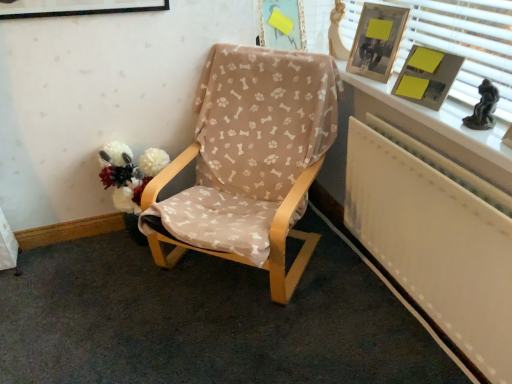
Image resolution: width=512 pixels, height=384 pixels. What do you see at coordinates (426, 76) in the screenshot? I see `yellow paper at upper right` at bounding box center [426, 76].

Where is `yellow paper at upper right`? The image size is (512, 384). yellow paper at upper right is located at coordinates (426, 76).

The image size is (512, 384). Describe the element at coordinates (248, 162) in the screenshot. I see `beige fabric-covered chair at center` at that location.

Measure the distance between white painted wood at upper right and camera.

A distance of 1.34 meters exists between white painted wood at upper right and camera.

Find the location of `matte plastic picture frame at upper center, which ranks as the 1th picture frame in back-to-front order`. matte plastic picture frame at upper center, which ranks as the 1th picture frame in back-to-front order is located at coordinates (282, 24).

Does white painted wood at upper right have a lesser height compared to matte plastic picture frame at upper center, positioned as the 1th picture frame in left-to-right order?

Incorrect, the height of white painted wood at upper right does not fall short of that of matte plastic picture frame at upper center, positioned as the 1th picture frame in left-to-right order.

Is white painted wood at upper right directly adjacent to matte plastic picture frame at upper center, which ranks as the 1th picture frame in back-to-front order?

No, white painted wood at upper right is not making contact with matte plastic picture frame at upper center, which ranks as the 1th picture frame in back-to-front order.

In the scene shown: Does white painted wood at upper right have a smaller size compared to matte plastic picture frame at upper center, acting as the 2th picture frame starting from the right?

Yes.

Where is `picture frame that is the 2nd object located behind the white painted wood at upper right`? This screenshot has width=512, height=384. picture frame that is the 2nd object located behind the white painted wood at upper right is located at coordinates (282, 24).

From the image's perspective, is matte plastic picture frame at upper center, which ranks as the 1th picture frame in back-to-front order, located above or below beige fabric-covered chair at center?

From the image's perspective, matte plastic picture frame at upper center, which ranks as the 1th picture frame in back-to-front order, appears above beige fabric-covered chair at center.

Is matte plastic picture frame at upper center, the 2th picture frame viewed from the front, facing away from beige fabric-covered chair at center?

No, matte plastic picture frame at upper center, the 2th picture frame viewed from the front, is not facing the opposite direction of beige fabric-covered chair at center.

How different are the orientations of matte plastic picture frame at upper center, which ranks as the 1th picture frame in back-to-front order, and beige fabric-covered chair at center in degrees?

There is a 36.7-degree angle between the facing directions of matte plastic picture frame at upper center, which ranks as the 1th picture frame in back-to-front order, and beige fabric-covered chair at center.

Which is farther from the camera, (259, 15) or (228, 123)?

Point (259, 15)

Considering the relative sizes of yellow paper at upper right and white painted wood at upper right in the image provided, is yellow paper at upper right bigger than white painted wood at upper right?

No.

Does yellow paper at upper right contain white painted wood at upper right?

No, white painted wood at upper right is not a part of yellow paper at upper right.

Is there a large distance between yellow paper at upper right and white painted wood at upper right?

yellow paper at upper right is actually quite close to white painted wood at upper right.

Is yellow paper at upper right in front of white painted wood at upper right?

No.

Considering the relative positions of white painted wood at upper right and wooden picture frame at upper right, placed as the second picture frame when sorted from left to right, in the image provided, is white painted wood at upper right behind wooden picture frame at upper right, placed as the second picture frame when sorted from left to right,?

No, white painted wood at upper right is closer to the viewer.

From a real-world perspective, is white painted wood at upper right physically located above or below wooden picture frame at upper right, the second picture frame in the back-to-front sequence?

Clearly, from a real-world perspective, white painted wood at upper right is above wooden picture frame at upper right, the second picture frame in the back-to-front sequence.

Is white painted wood at upper right oriented away from wooden picture frame at upper right, placed as the 1th picture frame when sorted from front to back?

Yes, white painted wood at upper right's orientation is away from wooden picture frame at upper right, placed as the 1th picture frame when sorted from front to back.

Based on the photo, which point is more forward, (456, 90) or (378, 28)?

Point (456, 90)

From a real-world perspective, is wooden picture frame at upper right, placed as the second picture frame when sorted from left to right, physically located above or below beige fabric-covered chair at center?

From a real-world perspective, wooden picture frame at upper right, placed as the second picture frame when sorted from left to right, is physically above beige fabric-covered chair at center.

Is wooden picture frame at upper right, which ranks as the 1th picture frame in right-to-left order, surrounding beige fabric-covered chair at center?

No, beige fabric-covered chair at center is located outside of wooden picture frame at upper right, which ranks as the 1th picture frame in right-to-left order.

What's the angular difference between wooden picture frame at upper right, the second picture frame in the back-to-front sequence, and beige fabric-covered chair at center's facing directions?

38.7 degrees.

From the image's perspective, between wooden picture frame at upper right, the second picture frame in the back-to-front sequence, and beige fabric-covered chair at center, who is located below?

beige fabric-covered chair at center, from the image's perspective.

Who is more distant, yellow paper at upper right or wooden picture frame at upper right, the second picture frame in the back-to-front sequence?

wooden picture frame at upper right, the second picture frame in the back-to-front sequence.

From the image's perspective, which one is positioned lower, yellow paper at upper right or wooden picture frame at upper right, the second picture frame in the back-to-front sequence?

From the image's view, yellow paper at upper right is below.

Can you confirm if yellow paper at upper right is taller than wooden picture frame at upper right, which ranks as the 1th picture frame in right-to-left order?

Incorrect, the height of yellow paper at upper right is not larger of that of wooden picture frame at upper right, which ranks as the 1th picture frame in right-to-left order.

Is yellow paper at upper right not within wooden picture frame at upper right, placed as the 1th picture frame when sorted from front to back?

Absolutely, yellow paper at upper right is external to wooden picture frame at upper right, placed as the 1th picture frame when sorted from front to back.

Could you tell me if beige fabric-covered chair at center is facing wooden picture frame at upper right, placed as the 1th picture frame when sorted from front to back?

No, beige fabric-covered chair at center is not facing towards wooden picture frame at upper right, placed as the 1th picture frame when sorted from front to back.

Based on the photo, how different are the orientations of beige fabric-covered chair at center and wooden picture frame at upper right, the second picture frame in the back-to-front sequence, in degrees?

The facing directions of beige fabric-covered chair at center and wooden picture frame at upper right, the second picture frame in the back-to-front sequence, are 38.7 degrees apart.

Is beige fabric-covered chair at center in front of or behind wooden picture frame at upper right, placed as the 1th picture frame when sorted from front to back, in the image?

In the image, beige fabric-covered chair at center appears in front of wooden picture frame at upper right, placed as the 1th picture frame when sorted from front to back.

From their relative heights in the image, would you say beige fabric-covered chair at center is taller or shorter than wooden picture frame at upper right, placed as the second picture frame when sorted from left to right?

Clearly, beige fabric-covered chair at center is taller compared to wooden picture frame at upper right, placed as the second picture frame when sorted from left to right.

Locate an element on the screen. window frame in front of the matte plastic picture frame at upper center, acting as the 2th picture frame starting from the right is located at coordinates (456, 40).

In order to click on chair that is on the left side of matte plastic picture frame at upper center, which ranks as the 1th picture frame in back-to-front order in this screenshot , I will do [x=248, y=162].

Which object lies nearer to the anchor point white painted wood at upper right, yellow paper at upper right or wooden picture frame at upper right, placed as the second picture frame when sorted from left to right?

Based on the image, yellow paper at upper right appears to be nearer to white painted wood at upper right.

Based on their spatial positions, is wooden picture frame at upper right, placed as the second picture frame when sorted from left to right, or yellow paper at upper right further from matte plastic picture frame at upper center, positioned as the 1th picture frame in left-to-right order?

Based on the image, yellow paper at upper right appears to be further to matte plastic picture frame at upper center, positioned as the 1th picture frame in left-to-right order.

Estimate the real-world distances between objects in this image. Which object is further from beige fabric-covered chair at center, wooden picture frame at upper right, the second picture frame in the back-to-front sequence, or yellow paper at upper right?

Based on the image, yellow paper at upper right appears to be further to beige fabric-covered chair at center.

When comparing their distances from yellow paper at upper right, does white painted wood at upper right or wooden picture frame at upper right, placed as the second picture frame when sorted from left to right, seem closer?

The object closer to yellow paper at upper right is white painted wood at upper right.

Based on their spatial positions, is wooden picture frame at upper right, the second picture frame in the back-to-front sequence, or yellow paper at upper right closer to white painted wood at upper right?

The object closer to white painted wood at upper right is yellow paper at upper right.

From the image, which object appears to be farther from yellow paper at upper right, white painted wood at upper right or matte plastic picture frame at upper center, acting as the 2th picture frame starting from the right?

Among the two, matte plastic picture frame at upper center, acting as the 2th picture frame starting from the right, is located further to yellow paper at upper right.

When comparing their distances from matte plastic picture frame at upper center, acting as the 2th picture frame starting from the right, does wooden picture frame at upper right, placed as the 1th picture frame when sorted from front to back, or beige fabric-covered chair at center seem closer?

A: wooden picture frame at upper right, placed as the 1th picture frame when sorted from front to back.

Looking at the image, which one is located closer to beige fabric-covered chair at center, white painted wood at upper right or yellow paper at upper right?

white painted wood at upper right lies closer to beige fabric-covered chair at center than the other object.

Find the location of a particular element. This screenshot has height=384, width=512. picture frame between yellow paper at upper right and matte plastic picture frame at upper center, the 2th picture frame viewed from the front, from front to back is located at coordinates (377, 40).

The width and height of the screenshot is (512, 384). In order to click on window frame between beige fabric-covered chair at center and yellow paper at upper right in the horizontal direction in this screenshot , I will do pyautogui.click(x=456, y=40).

At what (x,y) coordinates should I click in order to perform the action: click on bulletin board positioned between white painted wood at upper right and matte plastic picture frame at upper center, the 2th picture frame viewed from the front, from near to far. Please return your answer as a coordinate pair (x, y). Looking at the image, I should click on (426, 76).

Image resolution: width=512 pixels, height=384 pixels. Find the location of `bulletin board located between white painted wood at upper right and wooden picture frame at upper right, placed as the 1th picture frame when sorted from front to back, in the depth direction`. bulletin board located between white painted wood at upper right and wooden picture frame at upper right, placed as the 1th picture frame when sorted from front to back, in the depth direction is located at coordinates (426, 76).